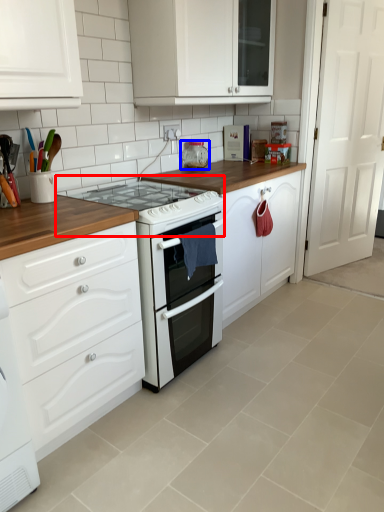
Question: Which object is further to the camera taking this photo, gas stove (highlighted by a red box) or appliance (highlighted by a blue box)?

Choices:
 (A) gas stove
 (B) appliance

Answer: (B)